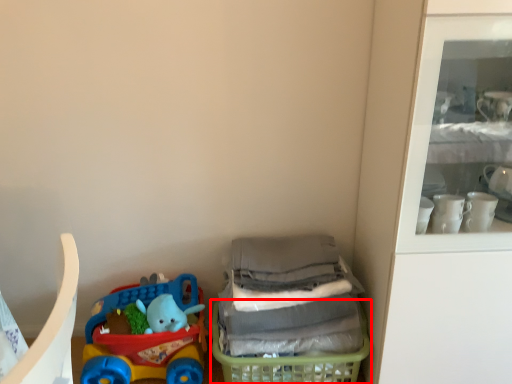
Question: Observing the image, what is the correct spatial positioning of basket (annotated by the red box) in reference to toy?

Choices:
 (A) left
 (B) right

Answer: (B)